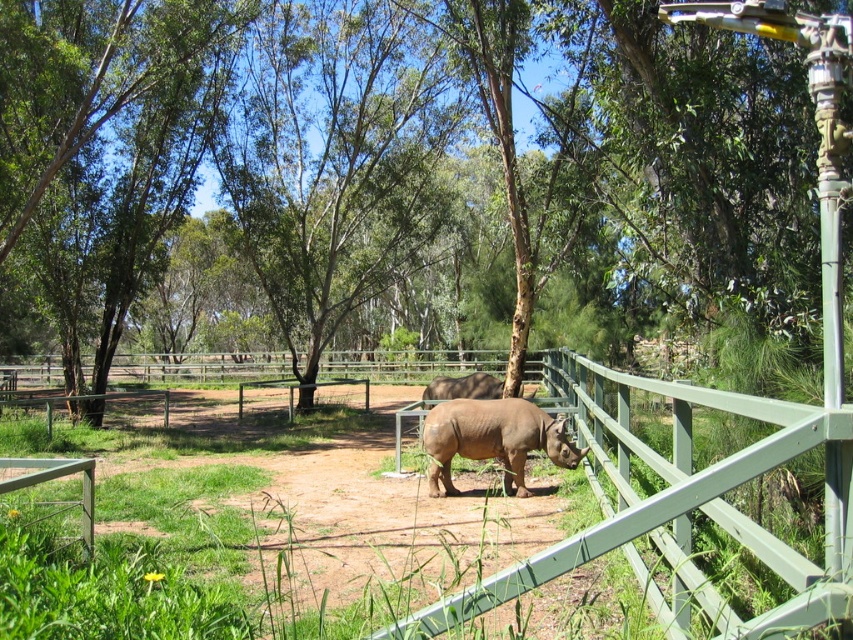
Which of these two, brown textured tree at center or brown matte rhinoceros at center, stands shorter?

brown matte rhinoceros at center is shorter.

Who is taller, brown textured tree at center or brown matte rhinoceros at center?

With more height is brown textured tree at center.

In order to click on brown textured tree at center in this screenshot , I will do `click(321, 168)`.